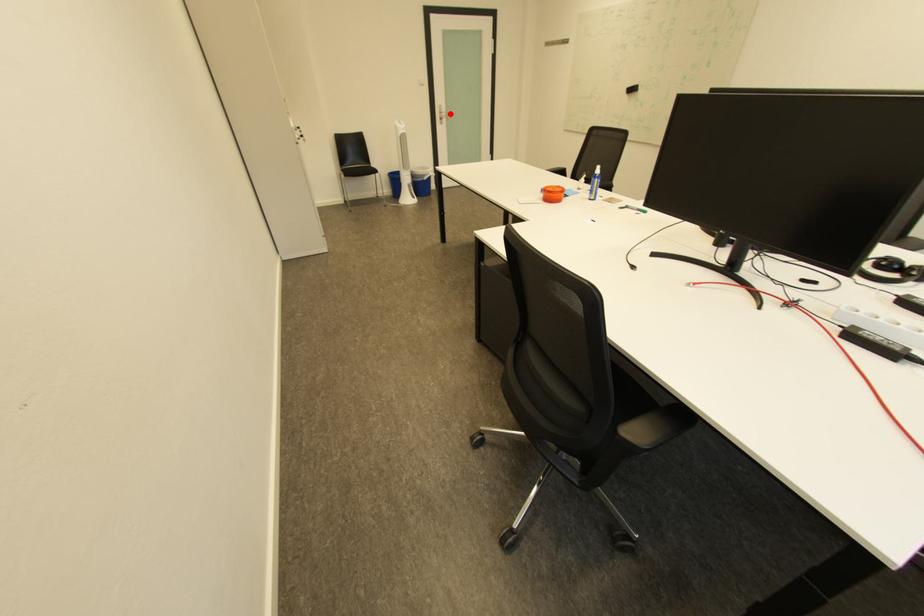
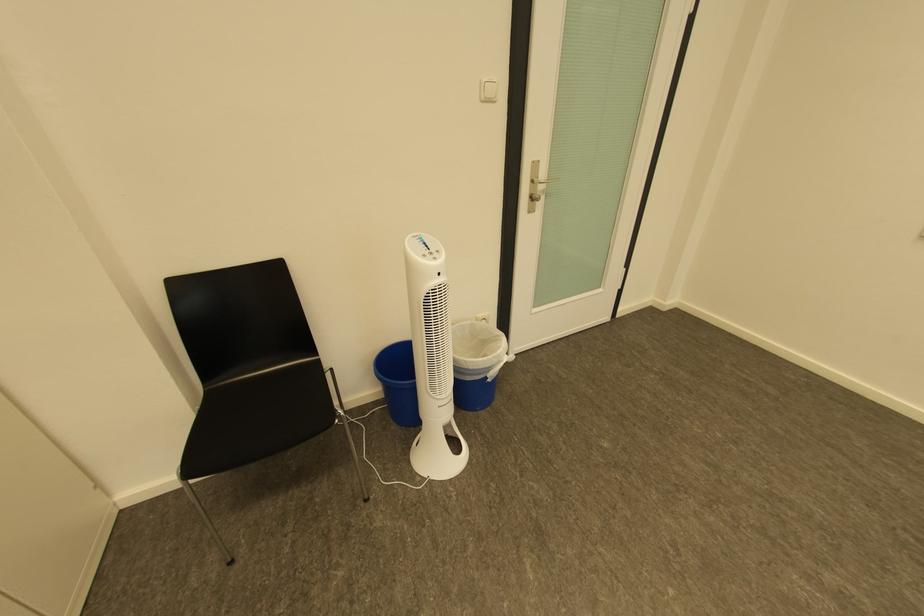
In the second image, find the point that corresponds to the highlighted location in the first image.

(541, 182)